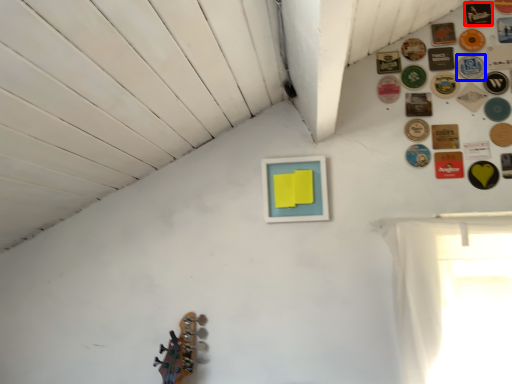
Question: Which object appears closest to the camera in this image, button (highlighted by a red box) or button (highlighted by a blue box)?

Choices:
 (A) button
 (B) button

Answer: (B)